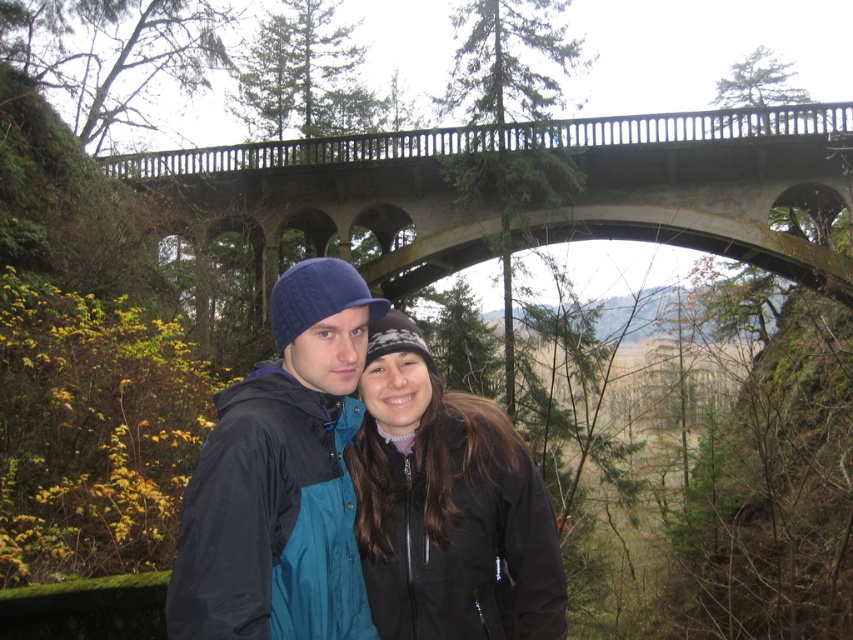
Identify the location of concrete bridge at upper center. (540, 209).

Does point (849, 161) come closer to viewer compared to point (438, 566)?

No, (849, 161) is behind (438, 566).

Image resolution: width=853 pixels, height=640 pixels. In order to click on concrete bridge at upper center in this screenshot , I will do `click(540, 209)`.

Does concrete bridge at upper center have a lesser height compared to blue knit cap at center?

Correct, concrete bridge at upper center is not as tall as blue knit cap at center.

At what (x,y) coordinates should I click in order to perform the action: click on concrete bridge at upper center. Please return your answer as a coordinate pair (x, y). The image size is (853, 640). Looking at the image, I should click on (540, 209).

Is point (427, 264) positioned before point (251, 579)?

No, it is behind (251, 579).

Where is `concrete bridge at upper center`? concrete bridge at upper center is located at coordinates (540, 209).

Is blue knit cap at center thinner than black softshell jacket at center?

Correct, blue knit cap at center's width is less than black softshell jacket at center's.

Between blue knit cap at center and black softshell jacket at center, which one is positioned lower?

black softshell jacket at center is lower down.

Is point (230, 442) more distant than point (378, 570)?

No, (230, 442) is closer to viewer.

This screenshot has width=853, height=640. In order to click on blue knit cap at center in this screenshot , I will do `click(281, 477)`.